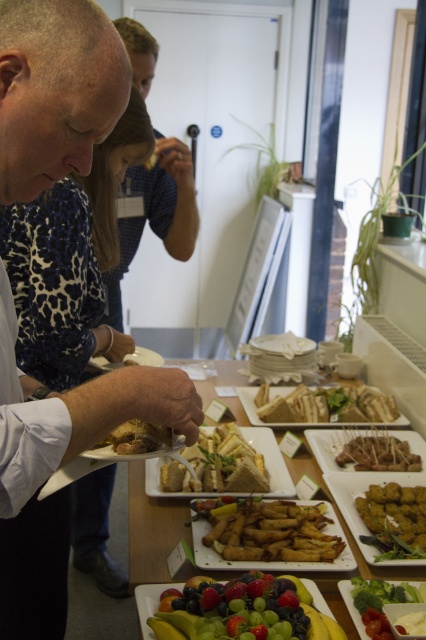
You are standing at the point labeled point (x=322, y=550) in the image. You want to take a photo of the buffet table with your phone, which has a maximum focus range of 1.25 meters. Will your phone be able to focus on the buffet table from this position?

The distance between the point labeled point (x=322, y=550) and the camera is 1.30 meters. Since the phone has a maximum focus range of 1.25 meters, the phone will not be able to focus on the buffet table from this position because the distance exceeds the focus limit.

You are at a buffet table and want to choose between the white bread at center and the green leafy salad at center. Which one is located to the left?

The white bread at center is positioned on the left side of the green leafy salad at center, so it is located to the left.